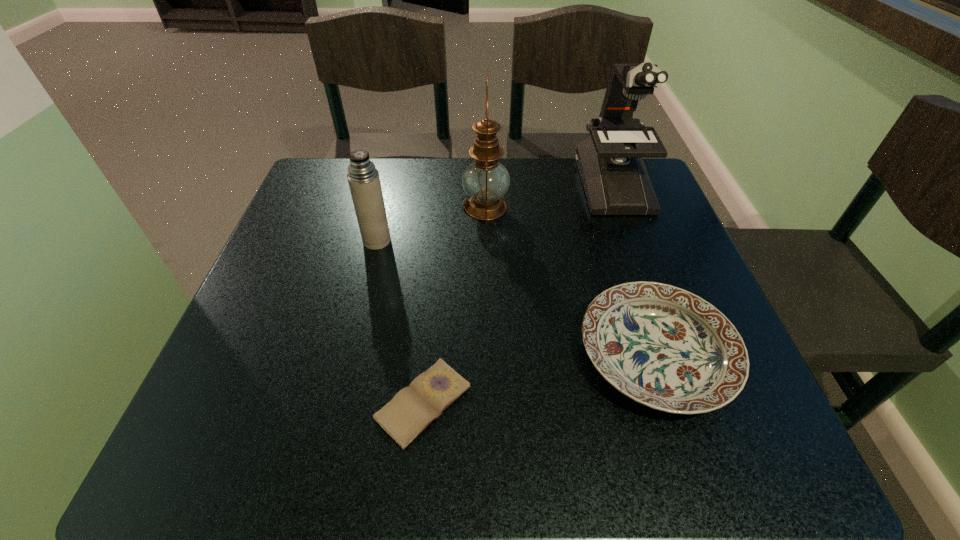
At what (x,y) coordinates should I click in order to perform the action: click on vacant space situated on the right of the shortest object. Please return your answer as a coordinate pair (x, y). The width and height of the screenshot is (960, 540). Looking at the image, I should click on (640, 403).

Where is `microscope located in the far edge section of the desktop`? The image size is (960, 540). microscope located in the far edge section of the desktop is located at coordinates (610, 161).

This screenshot has width=960, height=540. Identify the location of oil lamp positioned at the far edge. (486, 181).

Identify the location of plate at the near edge. (664, 347).

Where is `diary that is at the near edge`? The height and width of the screenshot is (540, 960). diary that is at the near edge is located at coordinates (412, 409).

Where is `microscope positioned at the right edge`? The height and width of the screenshot is (540, 960). microscope positioned at the right edge is located at coordinates (610, 161).

In order to click on plate present at the right edge in this screenshot , I will do `click(664, 347)`.

This screenshot has height=540, width=960. I want to click on object located at the far right corner, so click(610, 161).

This screenshot has width=960, height=540. Identify the location of object that is at the near right corner. (664, 347).

The width and height of the screenshot is (960, 540). In the image, there is a desktop. What are the coordinates of `vacant area at the far edge` in the screenshot? It's located at (558, 180).